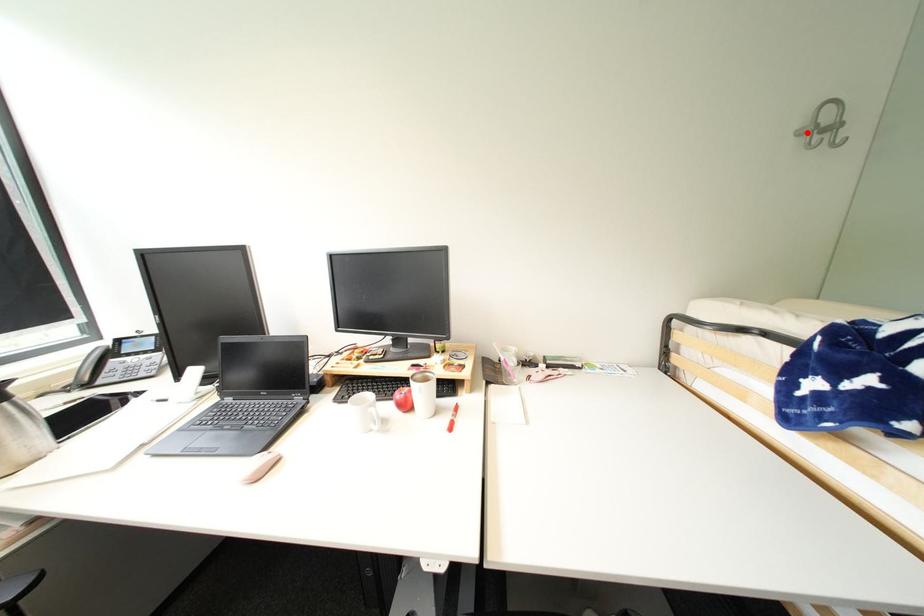
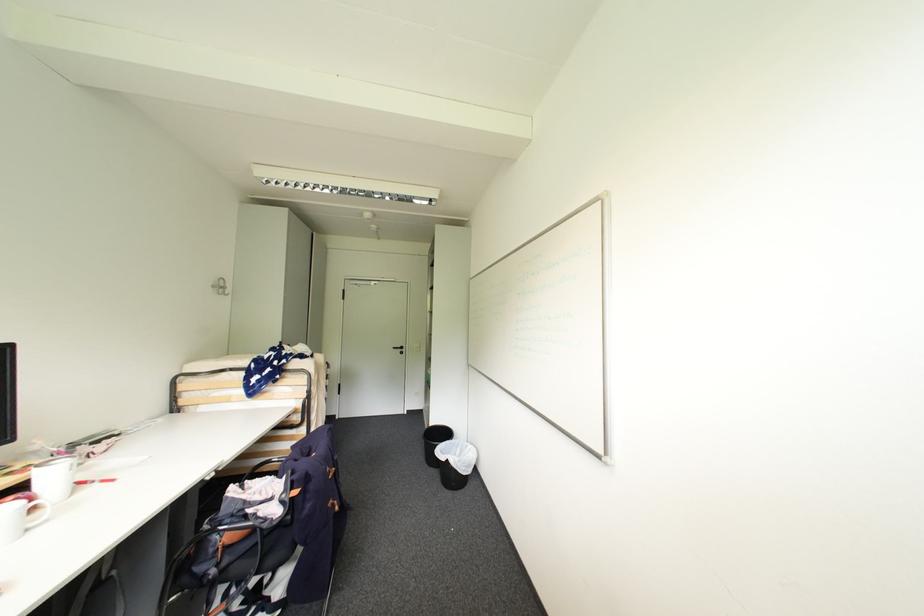
Find the pixel in the second image that matches the highlighted location in the first image.

(220, 286)